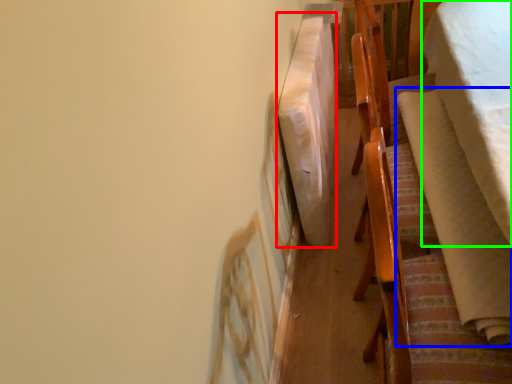
Question: Estimate the real-world distances between objects in this image. Which object is farther from blanket (highlighted by a red box), blanket (highlighted by a blue box) or blanket (highlighted by a green box)?

Choices:
 (A) blanket
 (B) blanket

Answer: (B)